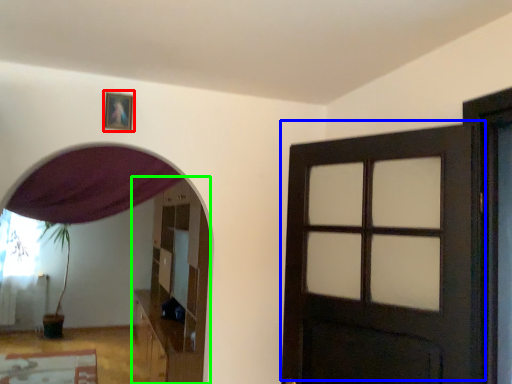
Question: Which object is the farthest from picture frame (highlighted by a red box)? Choose among these: door (highlighted by a blue box) or dresser (highlighted by a green box).

Choices:
 (A) door
 (B) dresser

Answer: (B)